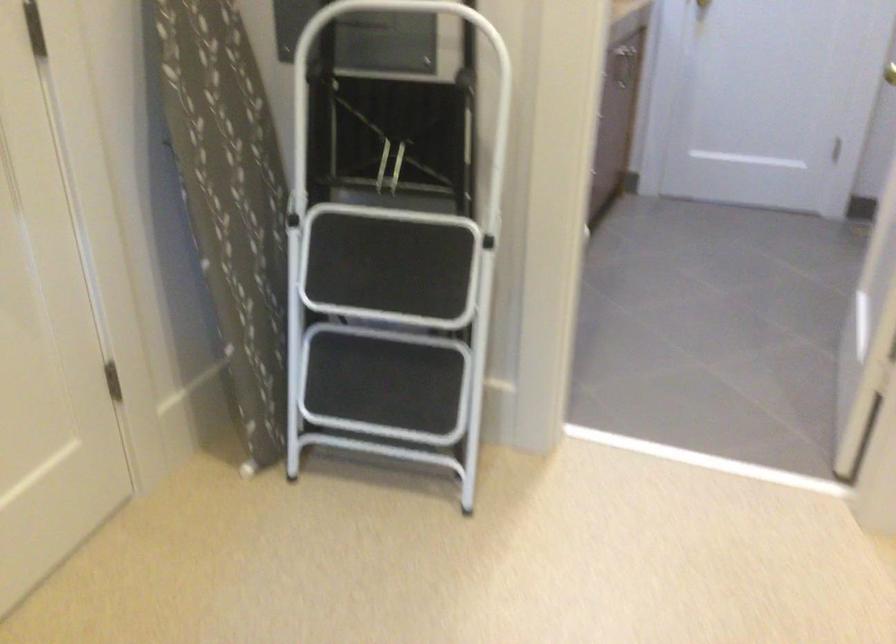
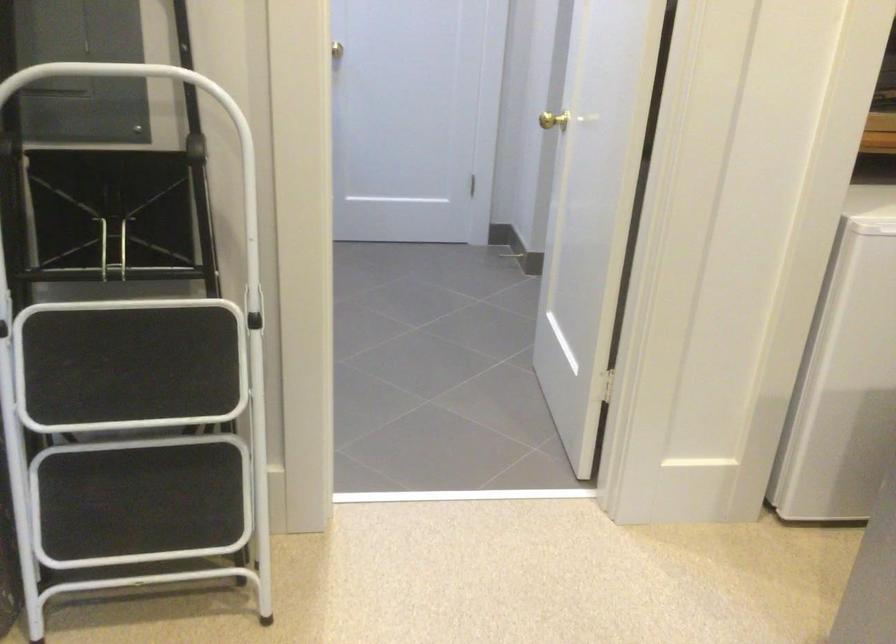
Question: The camera is either moving clockwise (left) or counter-clockwise (right) around the object. The first image is from the beginning of the video and the second image is from the end. Is the camera moving left or right when shooting the video?

Choices:
 (A) Left
 (B) Right

Answer: (A)